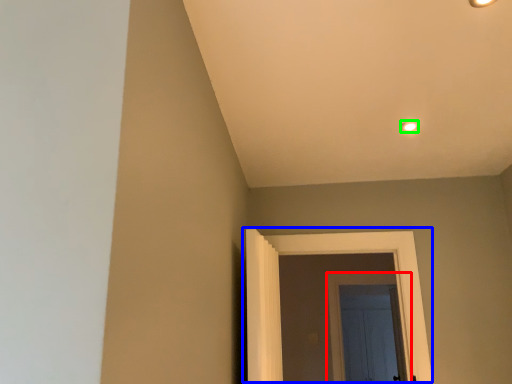
Question: Which object is positioned closest to door (highlighted by a red box)? Select from door (highlighted by a blue box) and light fixture (highlighted by a green box).

Choices:
 (A) door
 (B) light fixture

Answer: (A)